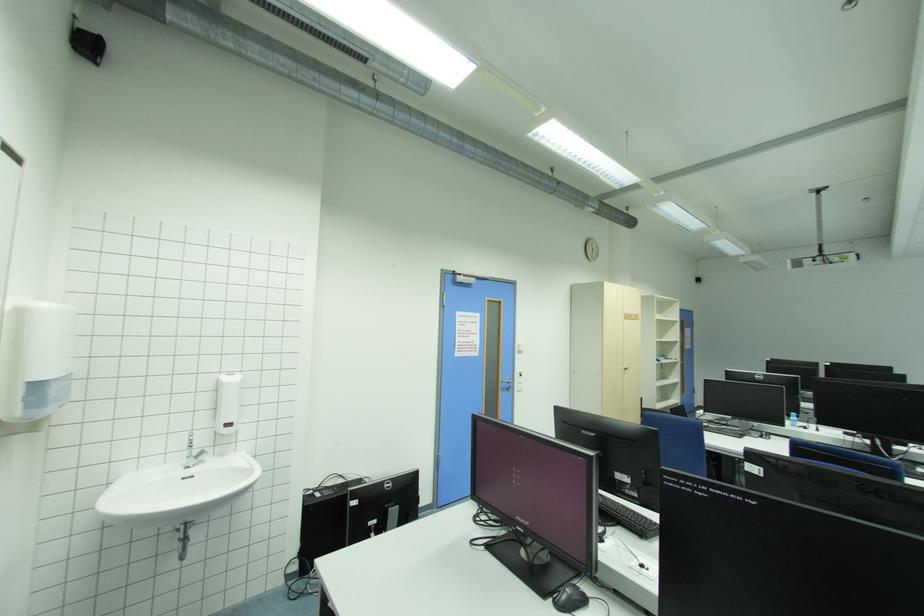
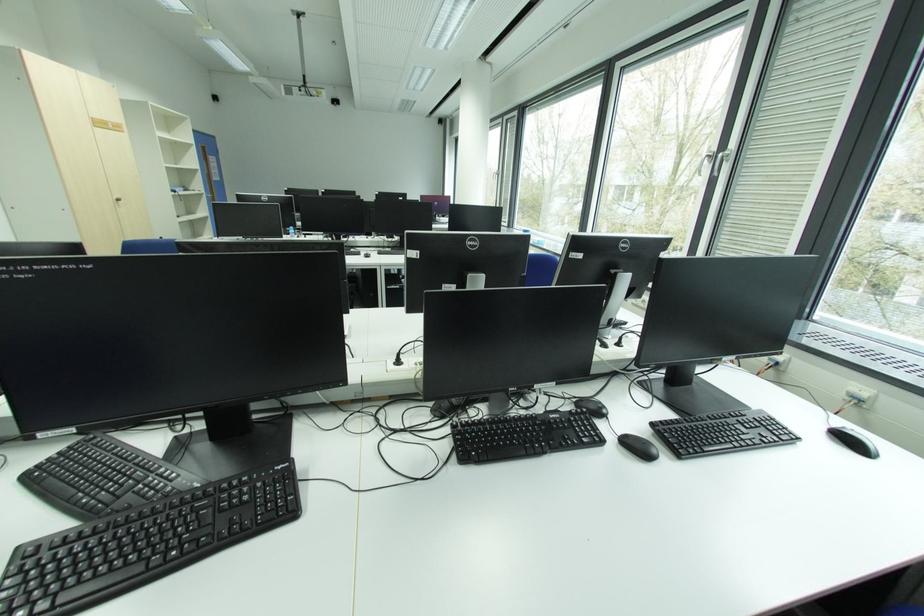
Find the pixel in the second image that matches (x=629, y=369) in the first image.

(120, 199)